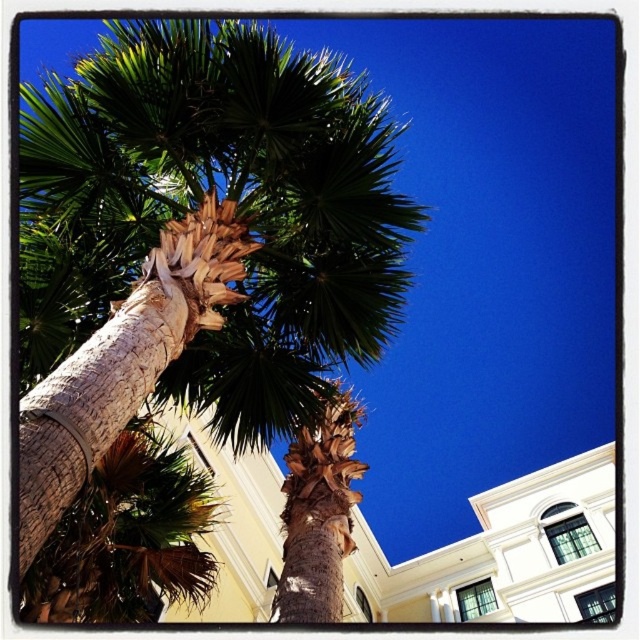
You are standing in the middle of the scene and want to reach the top of the green leafy palm tree at center. Can you climb the brown textured bark at center to do so?

The green leafy palm tree at center is taller than the brown textured bark at center. Therefore, you can climb the brown textured bark at center to reach the top of the green leafy palm tree at center since it is shorter but part of the same tree.

You are standing at the center of the image. Which direction should you move to reach the green leafy palm tree at center?

The green leafy palm tree at center is already at the center of the image, so you don not need to move in any direction to reach it.

From the picture: You are a botanist measuring the distance between two parts of a palm tree. You have a measuring tape that can extend up to 10 meters. Can you measure the distance between the green leafy palm tree at center and the brown textured bark at center without needing to extend the tape beyond its limit?

The distance between the green leafy palm tree at center and the brown textured bark at center is 11.48 meters, which exceeds the 10 meter limit of the measuring tape. Therefore, the botanist cannot measure the distance without extending the tape beyond its limit.